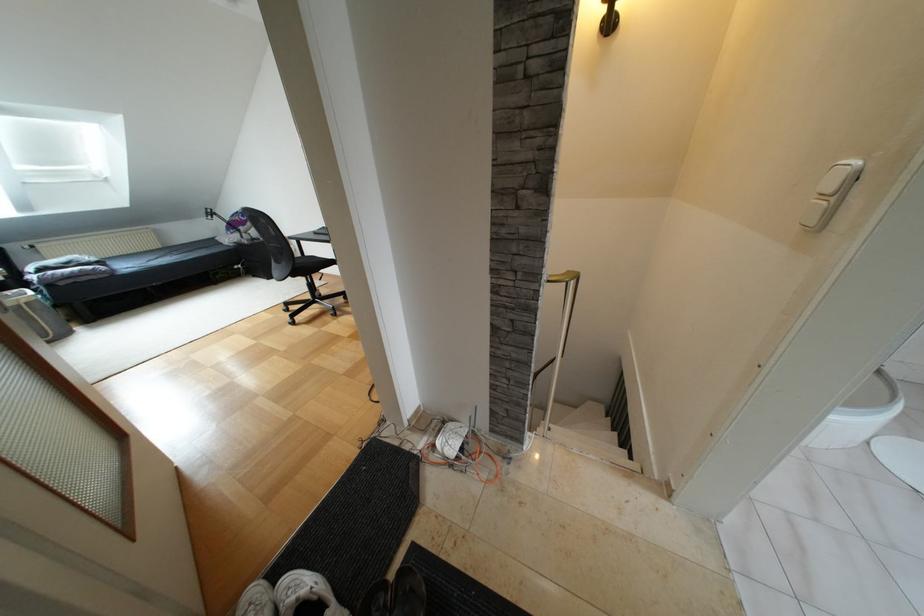
The height and width of the screenshot is (616, 924). What are the coordinates of `white toilet lid` in the screenshot? It's located at [x=901, y=458].